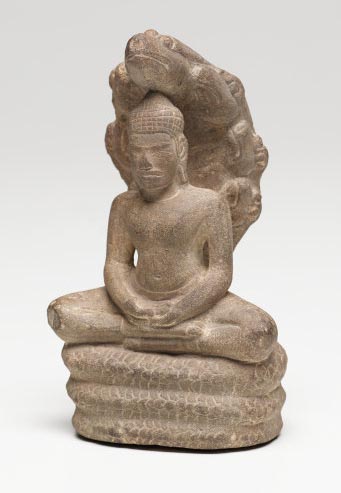
Locate an element on the screen. scales is located at coordinates (153, 372), (124, 366), (146, 396), (210, 406), (171, 433), (129, 435).